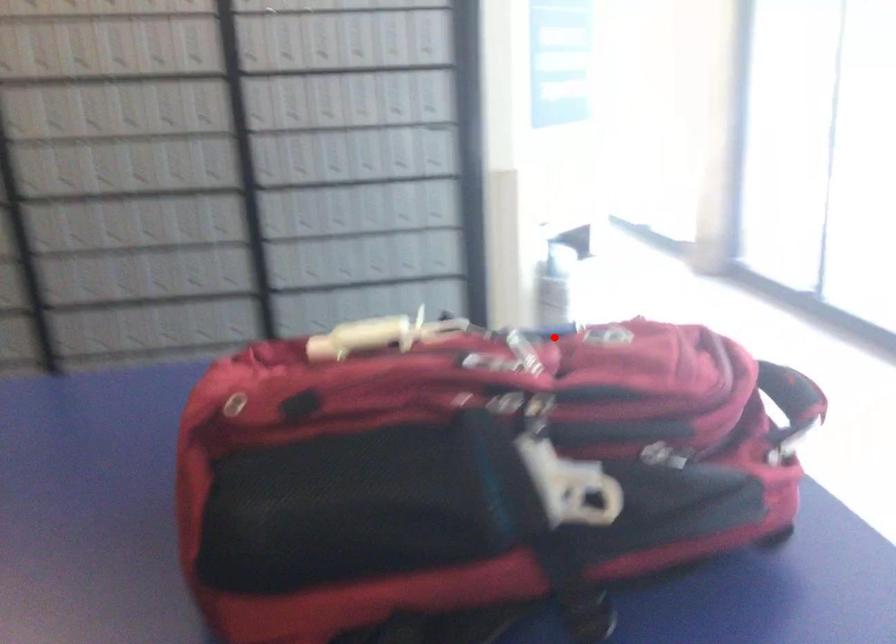
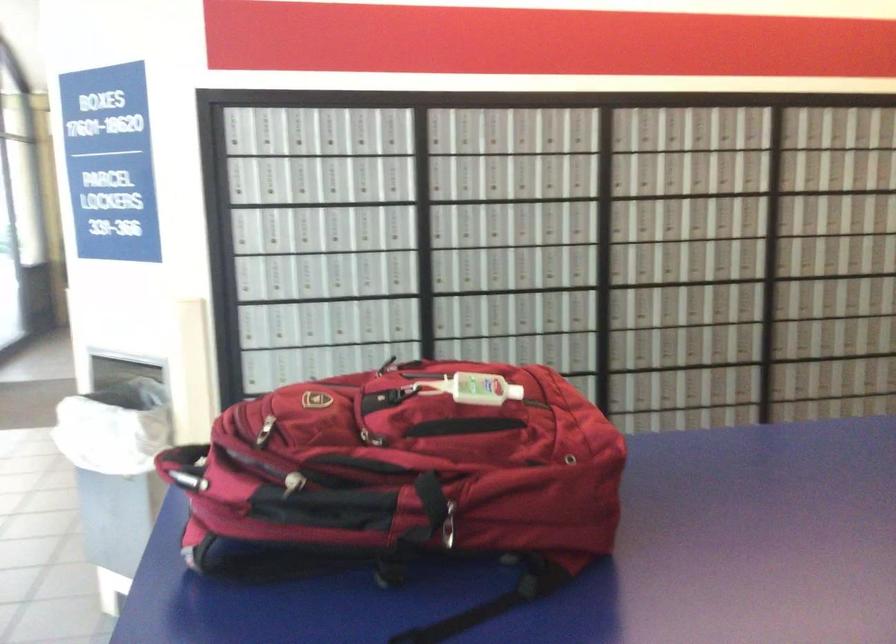
Where in the second image is the point corresponding to the highlighted location from the first image?

(293, 483)